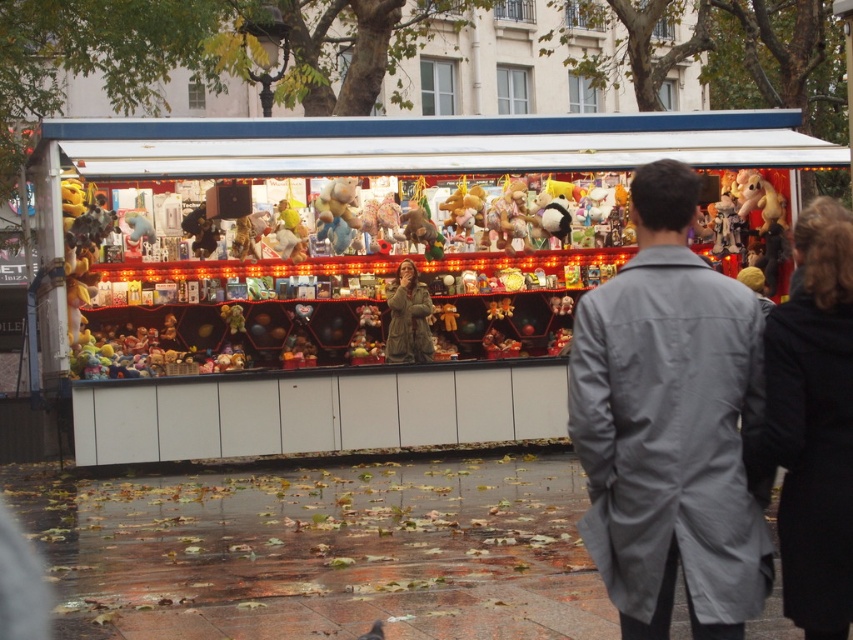
Can you confirm if matte plastic toy stand at center is bigger than gray fabric coat at center?

No.

Is point (445, 145) positioned in front of point (631, 188)?

No, it is not.

Identify the location of matte plastic toy stand at center. (363, 273).